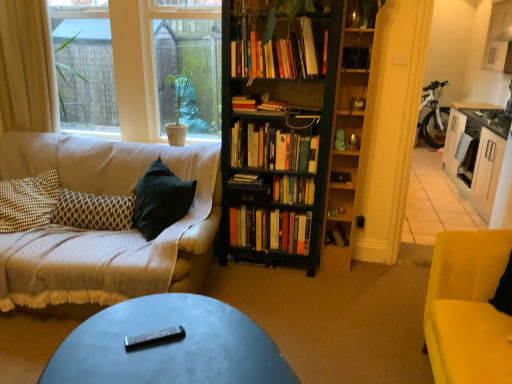
Locate an element on the screen. free space to the left of black plastic remote control at center is located at coordinates (112, 334).